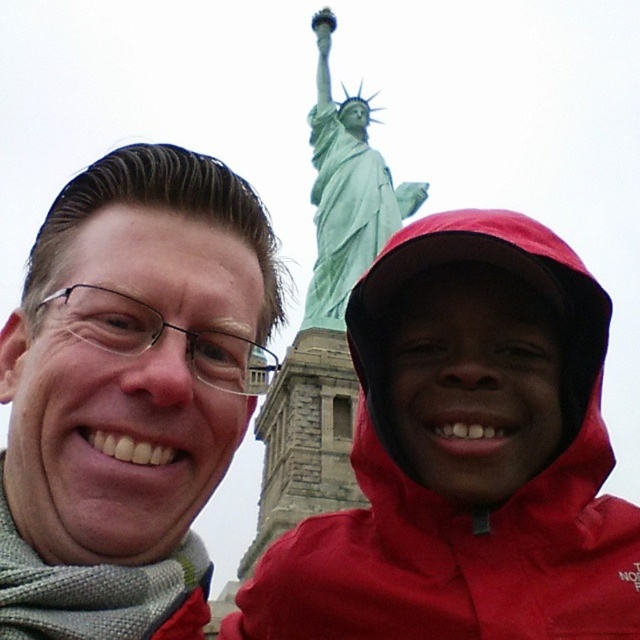
You are a photographer standing in front of the Statue of Liberty. You want to take a photo that includes both the matte black glasses at left and the green patina statue at upper center. Given that your camera has a maximum zoom range of 100 feet, can you capture both objects in a single frame without moving your position?

The matte black glasses at left and the green patina statue at upper center are 125.04 feet apart. Since the camera can only zoom up to 100 feet, the distance between them exceeds the maximum zoom range. Therefore, you cannot capture both objects in a single frame without moving your position.

You are a photographer trying to capture a photo of the green patina statue at upper center. There is a red waterproof jacket at center blocking your view. Can you determine which direction you should move to get the statue in your frame without the jacket?

The red waterproof jacket at center is to the left of the green patina statue at upper center. To avoid the jacket, move to the right side so the statue is no longer blocked.